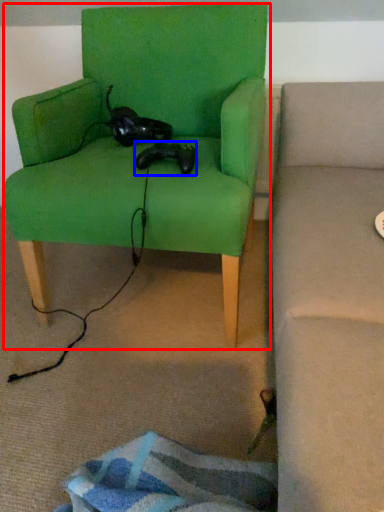
Question: Which object is closer to the camera taking this photo, chair (highlighted by a red box) or animal (highlighted by a blue box)?

Choices:
 (A) chair
 (B) animal

Answer: (A)